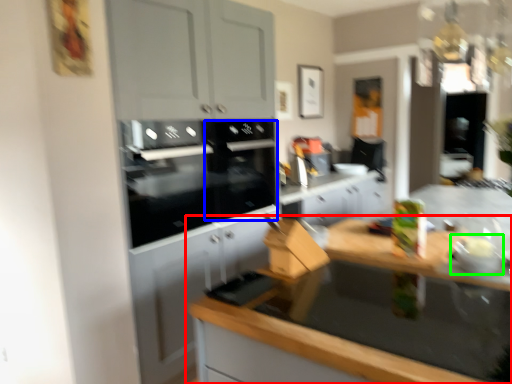
Question: Based on their relative distances, which object is nearer to countertop (highlighted by a red box)? Choose from appliance (highlighted by a blue box) and appliance (highlighted by a green box).

Choices:
 (A) appliance
 (B) appliance

Answer: (B)